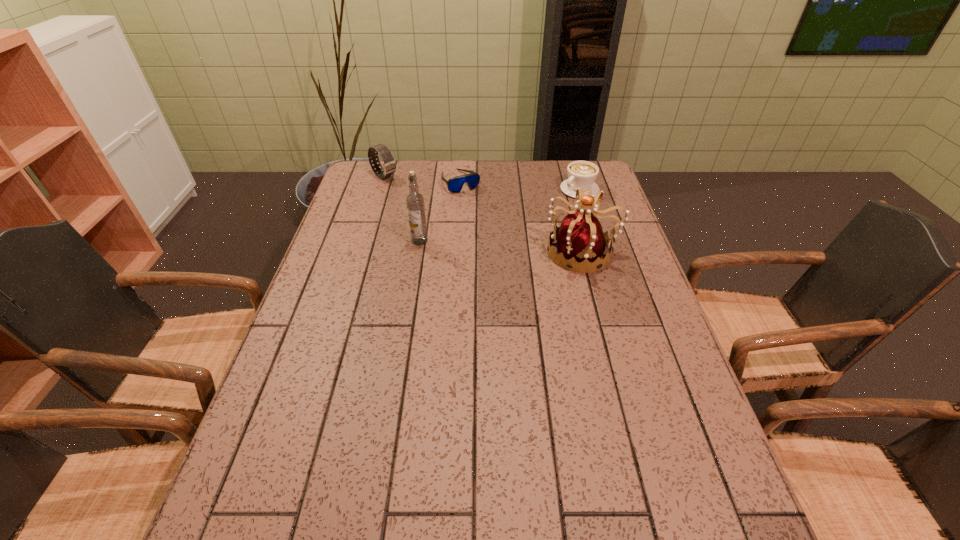
Where is `vacant space on the desktop that is between the vodka and the tiara and is positioned to the right of the cappuccino's handle`? vacant space on the desktop that is between the vodka and the tiara and is positioned to the right of the cappuccino's handle is located at coordinates (493, 246).

Identify the location of free space on the desktop that is between the vodka and the tiara and is positioned on the front-facing side of the shortest object. The height and width of the screenshot is (540, 960). (510, 247).

Find the location of a particular element. vacant space on the desktop that is between the vodka and the tiara and is positioned on the face of the leftmost object is located at coordinates (486, 245).